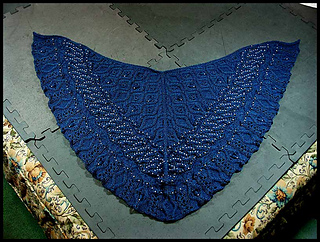
You are a GUI agent. You are given a task and a screenshot of the screen. Output one action in this format:
    pyautogui.click(x=<x>, y=<y>)
    Task: Click on the fabric
    The width and height of the screenshot is (320, 242).
    Given the screenshot: What is the action you would take?
    pyautogui.click(x=168, y=144)